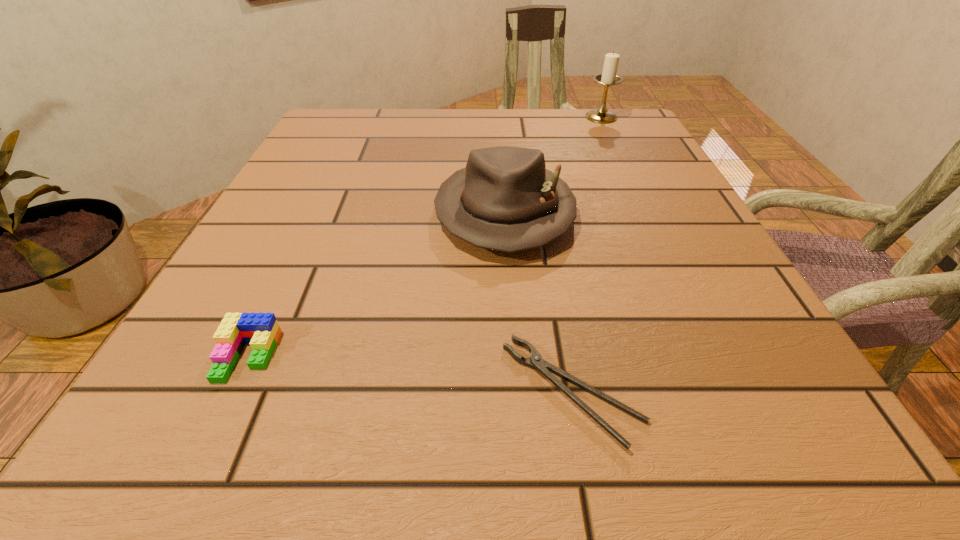
What are the coordinates of `free space at the near left corner of the desktop` in the screenshot? It's located at (243, 408).

Where is `vacant space at the far right corner of the desktop`? This screenshot has height=540, width=960. vacant space at the far right corner of the desktop is located at coordinates (577, 127).

Where is `free location at the near right corner of the desktop`? free location at the near right corner of the desktop is located at coordinates (746, 441).

This screenshot has width=960, height=540. Find the location of `empty space between the farthest object and the hat`. empty space between the farthest object and the hat is located at coordinates (553, 165).

Identify the location of empty location between the Lego and the second tallest object. (376, 284).

Find the location of a particular element. free spot between the candle holder and the leftmost object is located at coordinates (424, 237).

Identify the location of empty space between the third tallest object and the candle holder. Image resolution: width=960 pixels, height=540 pixels. pyautogui.click(x=424, y=237).

At what (x,y) coordinates should I click in order to perform the action: click on vacant space that's between the shortest object and the second tallest object. Please return your answer as a coordinate pair (x, y). This screenshot has width=960, height=540. Looking at the image, I should click on (539, 302).

Locate an element on the screen. free point between the Lego and the rightmost object is located at coordinates (424, 237).

Image resolution: width=960 pixels, height=540 pixels. Identify the location of unoccupied area between the leftmost object and the hat. (376, 284).